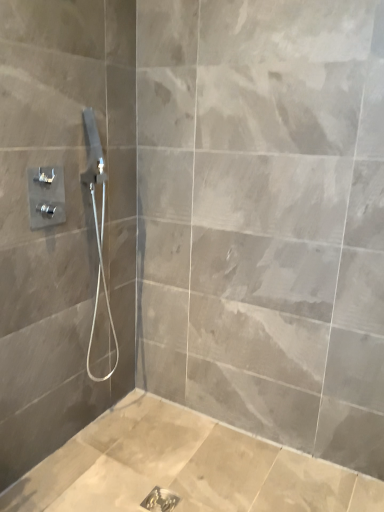
Question: Should I look upward or downward to see satin nickel showerhead at upper left?

Choices:
 (A) up
 (B) down

Answer: (B)